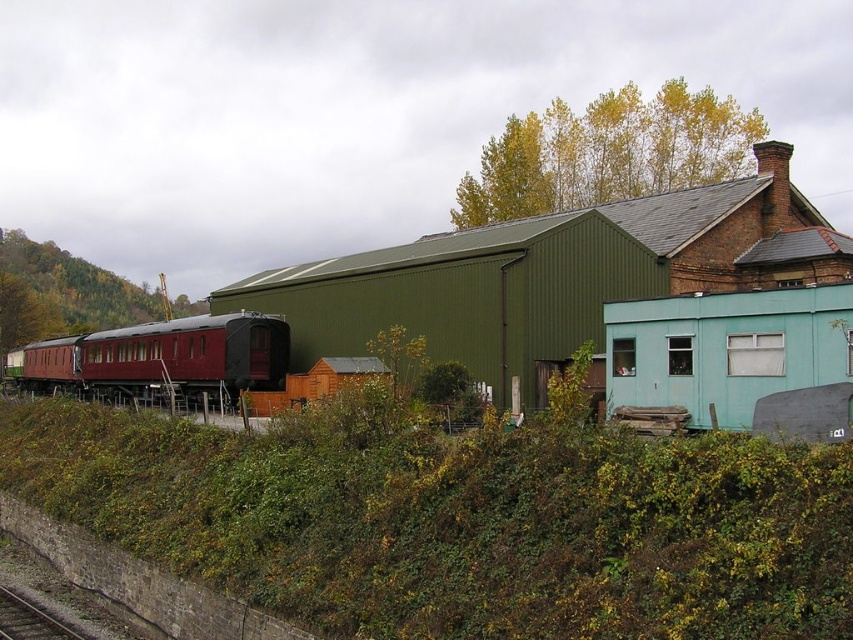
You are a maintenance worker assigned to inspect the maroon polished wood train car at left and the smooth metal train track at lower left. Based on the scene, which object would require a ladder for inspection due to its height?

The maroon polished wood train car at left is much taller than the smooth metal train track at lower left, so you would need a ladder to inspect the maroon polished wood train car at left.

You are a maintenance worker at the station. You need to walk from the green leafy vegetation at lower center to the smooth metal train track at lower left. Which direction should you head?

The green leafy vegetation at lower center is to the right of the smooth metal train track at lower left. Therefore, you should head to the left to reach the track from the vegetation.